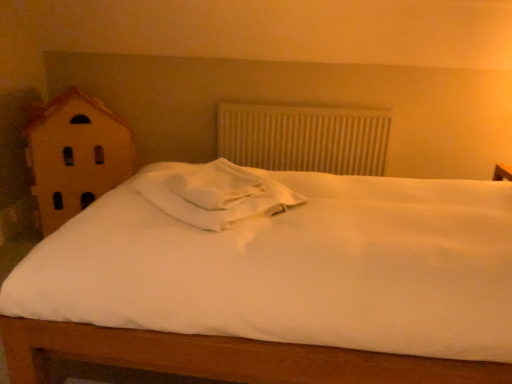
Question: From a real-world perspective, does white textured radiator at center sit lower than wooden house at left?

Choices:
 (A) yes
 (B) no

Answer: (B)

Question: Is white textured radiator at center thinner than wooden house at left?

Choices:
 (A) yes
 (B) no

Answer: (A)

Question: From the image's perspective, is white textured radiator at center below wooden house at left?

Choices:
 (A) yes
 (B) no

Answer: (B)

Question: Considering the relative sizes of white textured radiator at center and wooden house at left in the image provided, is white textured radiator at center wider than wooden house at left?

Choices:
 (A) no
 (B) yes

Answer: (A)

Question: From a real-world perspective, is white textured radiator at center physically above wooden house at left?

Choices:
 (A) no
 (B) yes

Answer: (B)

Question: Considering the relative positions of white textured radiator at center and wooden house at left in the image provided, is white textured radiator at center to the left or to the right of wooden house at left?

Choices:
 (A) right
 (B) left

Answer: (A)

Question: Is white textured radiator at center taller or shorter than wooden house at left?

Choices:
 (A) tall
 (B) short

Answer: (B)

Question: Looking at the image, does white textured radiator at center seem bigger or smaller compared to wooden house at left?

Choices:
 (A) small
 (B) big

Answer: (A)

Question: Is white textured radiator at center situated inside wooden house at left or outside?

Choices:
 (A) outside
 (B) inside

Answer: (A)

Question: Would you say wooden house at left is to the left or to the right of white soft pillow at center in the picture?

Choices:
 (A) left
 (B) right

Answer: (A)

Question: Would you say wooden house at left is inside or outside white soft pillow at center?

Choices:
 (A) inside
 (B) outside

Answer: (B)

Question: From a real-world perspective, is wooden house at left above or below white soft pillow at center?

Choices:
 (A) below
 (B) above

Answer: (A)

Question: From the image's perspective, is wooden house at left located above or below white soft pillow at center?

Choices:
 (A) below
 (B) above

Answer: (B)

Question: Is white soft pillow at center to the left or to the right of white textured radiator at center in the image?

Choices:
 (A) left
 (B) right

Answer: (A)

Question: From the image's perspective, is white soft pillow at center located above or below white textured radiator at center?

Choices:
 (A) below
 (B) above

Answer: (A)